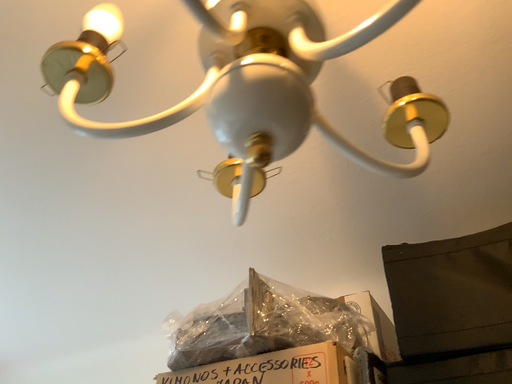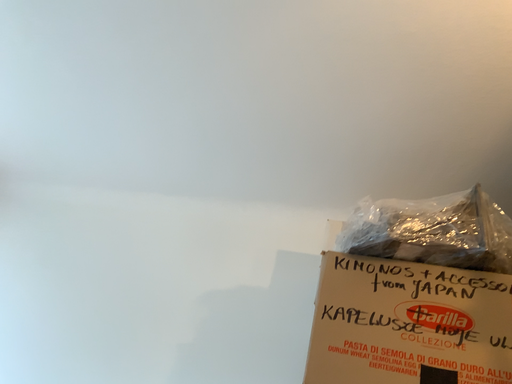
Question: How did the camera likely rotate when shooting the video?

Choices:
 (A) rotated upward
 (B) rotated downward

Answer: (B)